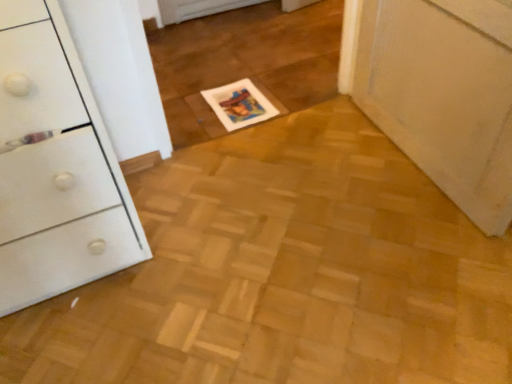
Locate an element on the screen. The image size is (512, 384). white glossy magazine at center is located at coordinates (239, 104).

What do you see at coordinates (239, 104) in the screenshot?
I see `white glossy magazine at center` at bounding box center [239, 104].

What do you see at coordinates (55, 167) in the screenshot? I see `white glossy chest of drawers at left` at bounding box center [55, 167].

Where is `white glossy chest of drawers at left`? white glossy chest of drawers at left is located at coordinates (55, 167).

You are a GUI agent. You are given a task and a screenshot of the screen. Output one action in this format:
    pyautogui.click(x=<x>, y=<y>)
    Task: Click on the white glossy magazine at center
    This screenshot has width=512, height=384.
    Given the screenshot: What is the action you would take?
    pyautogui.click(x=239, y=104)

Considering the relative positions of white glossy magazine at center and white glossy chest of drawers at left in the image provided, is white glossy magazine at center to the left of white glossy chest of drawers at left from the viewer's perspective?

In fact, white glossy magazine at center is to the right of white glossy chest of drawers at left.

Which object is more forward, white glossy magazine at center or white glossy chest of drawers at left?

white glossy chest of drawers at left is in front.

Considering the points (232, 129) and (74, 144), which point is behind, point (232, 129) or point (74, 144)?

The point (232, 129) is behind.

From the image's perspective, does white glossy magazine at center appear lower than white glossy chest of drawers at left?

No, from the image's perspective, white glossy magazine at center is not below white glossy chest of drawers at left.

From a real-world perspective, is white glossy magazine at center on top of white glossy chest of drawers at left?

Incorrect, from a real-world perspective, white glossy magazine at center is lower than white glossy chest of drawers at left.

From the picture: Considering the sizes of objects white glossy magazine at center and white glossy chest of drawers at left in the image provided, who is wider, white glossy magazine at center or white glossy chest of drawers at left?

Wider between the two is white glossy chest of drawers at left.

Is white glossy magazine at center taller than white glossy chest of drawers at left?

No.

Who is smaller, white glossy magazine at center or white glossy chest of drawers at left?

white glossy magazine at center is smaller.

Could white glossy chest of drawers at left be considered to be inside white glossy magazine at center?

That's incorrect, white glossy chest of drawers at left is not inside white glossy magazine at center.

Is white glossy magazine at center far from white glossy chest of drawers at left?

That's not correct — white glossy magazine at center is a little close to white glossy chest of drawers at left.

Is white glossy magazine at center oriented away from white glossy chest of drawers at left?

No, white glossy magazine at center is not facing away from white glossy chest of drawers at left.

How distant is white glossy magazine at center from white glossy chest of drawers at left?

white glossy magazine at center is 30.05 inches from white glossy chest of drawers at left.

In the image, there is a white glossy magazine at center. At what (x,y) coordinates should I click in order to perform the action: click on the chest of drawers below it (from the image's perspective). Please return your answer as a coordinate pair (x, y). Looking at the image, I should click on (55, 167).

Can you confirm if white glossy chest of drawers at left is positioned to the left of white glossy magazine at center?

Yes.

In the image, is white glossy chest of drawers at left positioned in front of or behind white glossy magazine at center?

Visually, white glossy chest of drawers at left is located in front of white glossy magazine at center.

Between point (32, 10) and point (214, 90), which one is positioned in front?

Positioned in front is point (32, 10).

From the image's perspective, is white glossy chest of drawers at left located above or below white glossy magazine at center?

From the image's perspective, white glossy chest of drawers at left appears below white glossy magazine at center.

Based on the photo, from a real-world perspective, between white glossy chest of drawers at left and white glossy magazine at center, who is vertically higher?

white glossy chest of drawers at left.

Can you confirm if white glossy chest of drawers at left is thinner than white glossy magazine at center?

No, white glossy chest of drawers at left is not thinner than white glossy magazine at center.

In terms of height, does white glossy chest of drawers at left look taller or shorter compared to white glossy magazine at center?

white glossy chest of drawers at left is taller than white glossy magazine at center.

Which of these two, white glossy chest of drawers at left or white glossy magazine at center, is bigger?

white glossy chest of drawers at left.

Can white glossy magazine at center be found inside white glossy chest of drawers at left?

No.

Are white glossy chest of drawers at left and white glossy magazine at center making contact?

No, white glossy chest of drawers at left is not touching white glossy magazine at center.

Does white glossy chest of drawers at left turn towards white glossy magazine at center?

No, white glossy chest of drawers at left is not facing towards white glossy magazine at center.

Can you tell me how much white glossy chest of drawers at left and white glossy magazine at center differ in facing direction?

The facing directions of white glossy chest of drawers at left and white glossy magazine at center are 178 degrees apart.

This screenshot has height=384, width=512. I want to click on magazine above the white glossy chest of drawers at left (from the image's perspective), so click(x=239, y=104).

In the image, there is a white glossy chest of drawers at left. Identify the location of magazine below it (from a real-world perspective). This screenshot has width=512, height=384. (239, 104).

The width and height of the screenshot is (512, 384). In order to click on the chest of drawers located below the white glossy magazine at center (from the image's perspective) in this screenshot , I will do `click(55, 167)`.